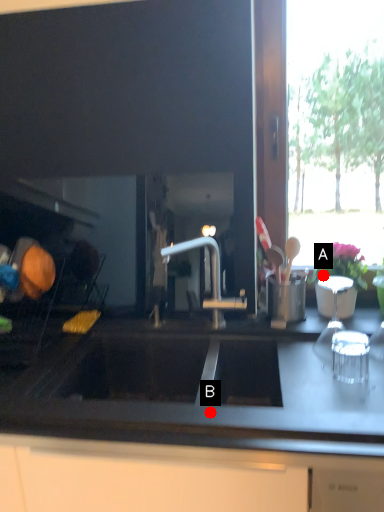
Question: Two points are circled on the image, labeled by A and B beside each circle. Which point is farther to the camera?

Choices:
 (A) A is further
 (B) B is further

Answer: (A)